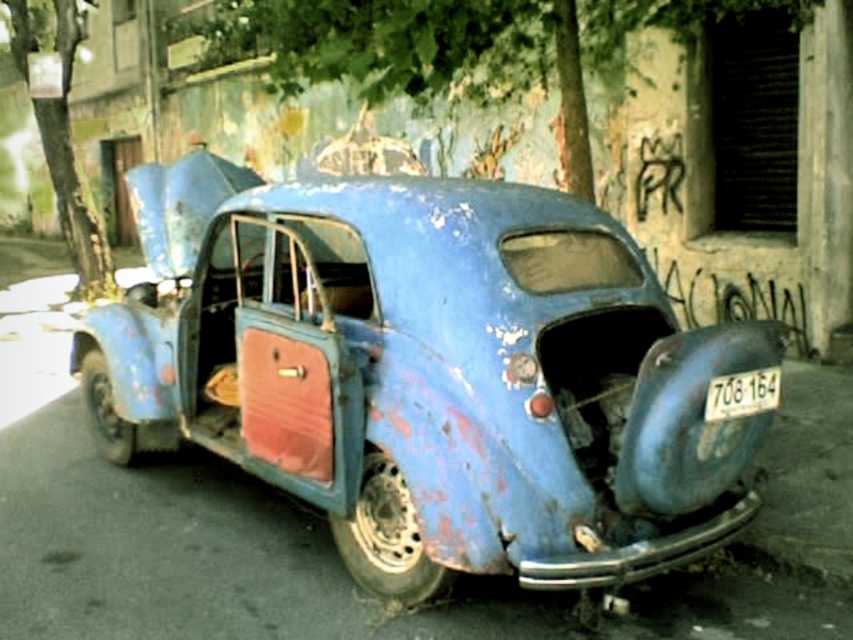
You are a pedestrian standing on the street and see the rusty blue car at center and the white plastic license plate at center. Which object is closer to you?

The rusty blue car at center is closer to you since it is in front of the white plastic license plate at center.